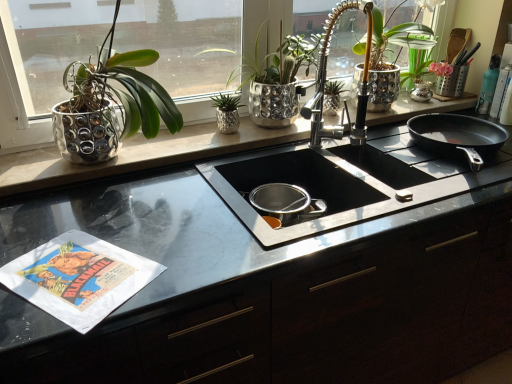
The width and height of the screenshot is (512, 384). In order to click on blank space situated above black stainless steel gas stove at center (from a real-world perspective) in this screenshot , I will do `click(410, 161)`.